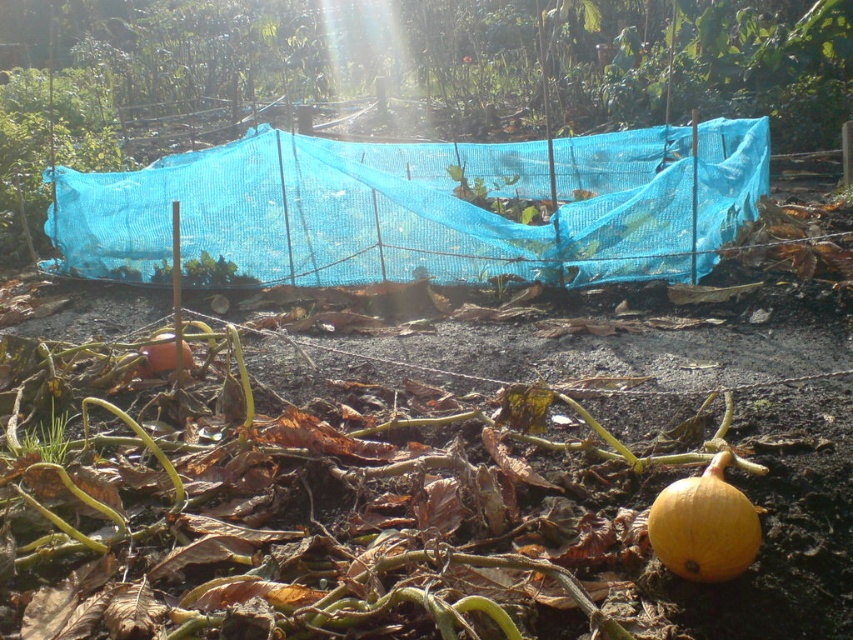
You are a gardener who wants to select the pumpkin with a wider base for a carving contest. Which pumpkin between the orange matte pumpkin at lower right and the orange matte pumpkin at lower left should you choose?

The orange matte pumpkin at lower left has a wider base than the orange matte pumpkin at lower right, so you should choose the orange matte pumpkin at lower left.